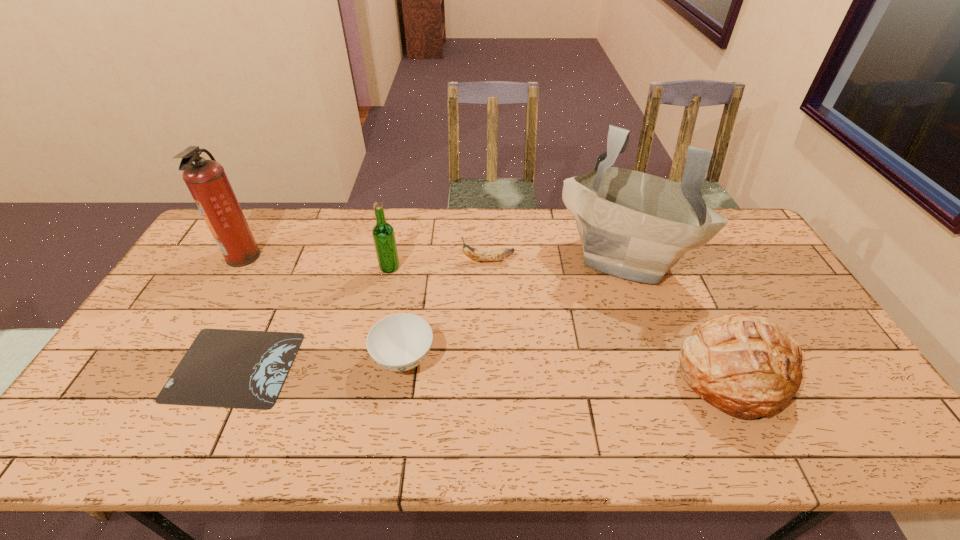
Image resolution: width=960 pixels, height=540 pixels. I want to click on object that is the third nearest to the beer bottle, so click(x=244, y=369).

The height and width of the screenshot is (540, 960). In order to click on free region that satisfies the following two spatial constraints: 1. on the front side of the shopping bag; 2. at the stem of the banana in this screenshot , I will do `click(627, 260)`.

The image size is (960, 540). Find the location of `free space that satisfies the following two spatial constraints: 1. on the front side of the shortest object; 2. on the right side of the fourth shortest object`. free space that satisfies the following two spatial constraints: 1. on the front side of the shortest object; 2. on the right side of the fourth shortest object is located at coordinates (230, 375).

The height and width of the screenshot is (540, 960). What are the coordinates of `free space that satisfies the following two spatial constraints: 1. on the back side of the mousepad; 2. at the nozzle of the fire extinguisher` in the screenshot? It's located at (287, 256).

Locate an element on the screen. The width and height of the screenshot is (960, 540). vacant region that satisfies the following two spatial constraints: 1. at the nozzle of the shortest object; 2. on the left side of the fire extinguisher is located at coordinates (179, 366).

This screenshot has width=960, height=540. In order to click on vacant point that satisfies the following two spatial constraints: 1. at the nozzle of the fire extinguisher; 2. on the back side of the shortest object in this screenshot , I will do pos(179,366).

Find the location of a particular element. The width and height of the screenshot is (960, 540). vacant space that satisfies the following two spatial constraints: 1. on the back side of the mousepad; 2. on the right side of the chinaware is located at coordinates (238, 358).